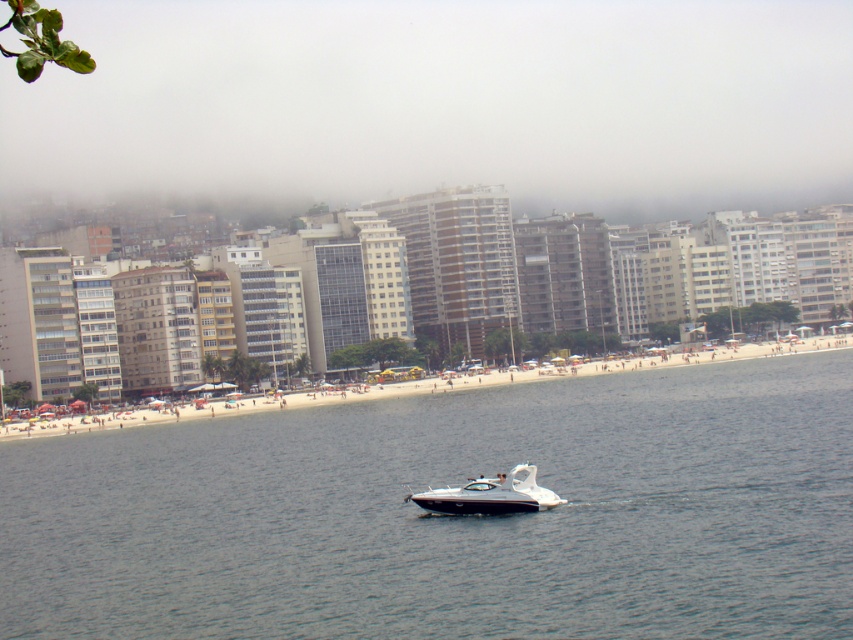
In the scene shown: You are standing at the beach and want to locate two points marked in the image. The first point is at coordinates point (566, 561) and the second is at point (451, 499). Which point is nearer to you?

Point (566, 561) is closer to the viewer than point (451, 499).

Consider the image. You are a lifeguard standing on the beach and want to reach the clear blue water at center. Which direction should you walk from the white sand beach at center?

The clear blue water at center is below the white sand beach at center, so you should walk downward towards the clear blue water at center from the white sand beach at center.